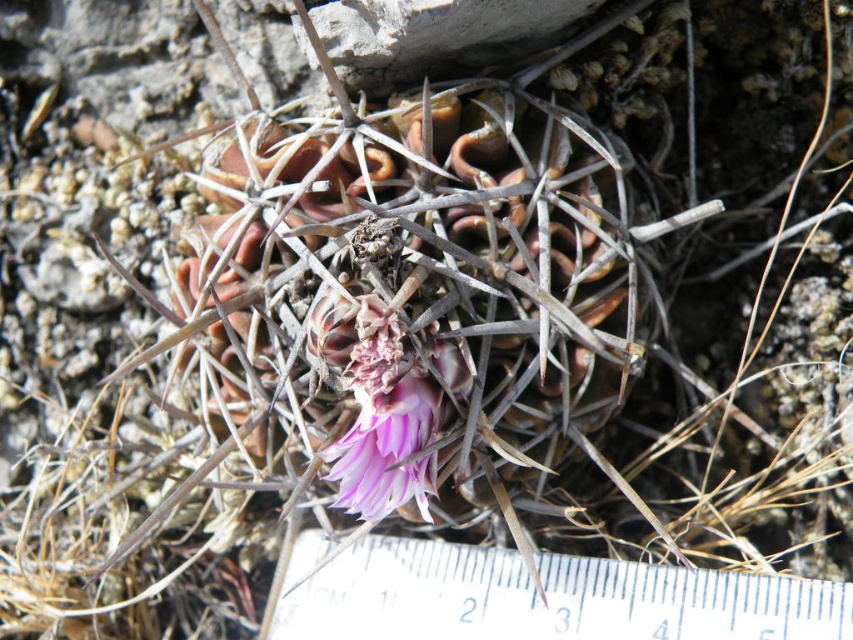
Based on the photo, can you confirm if white plastic ruler at center is wider than pink matte flower at center?

Yes, white plastic ruler at center is wider than pink matte flower at center.

Which is more to the right, white plastic ruler at center or pink matte flower at center?

Positioned to the right is white plastic ruler at center.

Who is more distant from viewer, (505, 624) or (368, 355)?

Point (505, 624)

Where is `white plastic ruler at center`? white plastic ruler at center is located at coordinates coord(547,598).